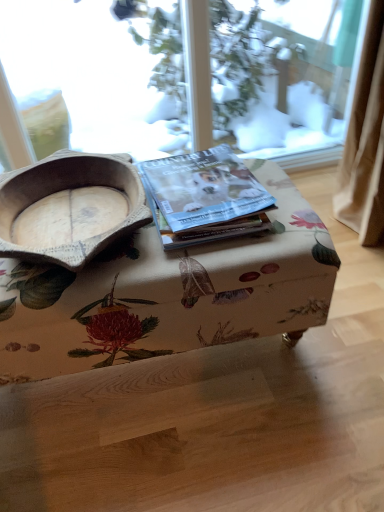
Question: Considering the relative sizes of wooden bowl at left and floral fabric ottoman at center in the image provided, is wooden bowl at left wider than floral fabric ottoman at center?

Choices:
 (A) no
 (B) yes

Answer: (B)

Question: Is wooden bowl at left positioned with its back to floral fabric ottoman at center?

Choices:
 (A) no
 (B) yes

Answer: (A)

Question: Can you confirm if wooden bowl at left is bigger than floral fabric ottoman at center?

Choices:
 (A) yes
 (B) no

Answer: (B)

Question: Is wooden bowl at left not near floral fabric ottoman at center?

Choices:
 (A) yes
 (B) no

Answer: (B)

Question: Does wooden bowl at left come in front of floral fabric ottoman at center?

Choices:
 (A) no
 (B) yes

Answer: (B)

Question: From a real-world perspective, is floral fabric ottoman at center positioned above or below wooden bowl at left?

Choices:
 (A) below
 (B) above

Answer: (A)

Question: Looking at their shapes, would you say floral fabric ottoman at center is wider or thinner than wooden bowl at left?

Choices:
 (A) thin
 (B) wide

Answer: (A)

Question: From their relative heights in the image, would you say floral fabric ottoman at center is taller or shorter than wooden bowl at left?

Choices:
 (A) tall
 (B) short

Answer: (A)

Question: Is floral fabric ottoman at center situated inside wooden bowl at left or outside?

Choices:
 (A) inside
 (B) outside

Answer: (B)

Question: Is wooden bowl at left bigger or smaller than matte paper magazine at center?

Choices:
 (A) small
 (B) big

Answer: (B)

Question: Is wooden bowl at left inside or outside of matte paper magazine at center?

Choices:
 (A) outside
 (B) inside

Answer: (A)

Question: Is wooden bowl at left wider or thinner than matte paper magazine at center?

Choices:
 (A) wide
 (B) thin

Answer: (A)

Question: In the image, is wooden bowl at left positioned in front of or behind matte paper magazine at center?

Choices:
 (A) behind
 (B) front

Answer: (B)

Question: Based on their positions, is floral fabric ottoman at center located to the left or right of matte paper magazine at center?

Choices:
 (A) right
 (B) left

Answer: (B)

Question: From the image's perspective, relative to matte paper magazine at center, is floral fabric ottoman at center above or below?

Choices:
 (A) below
 (B) above

Answer: (A)